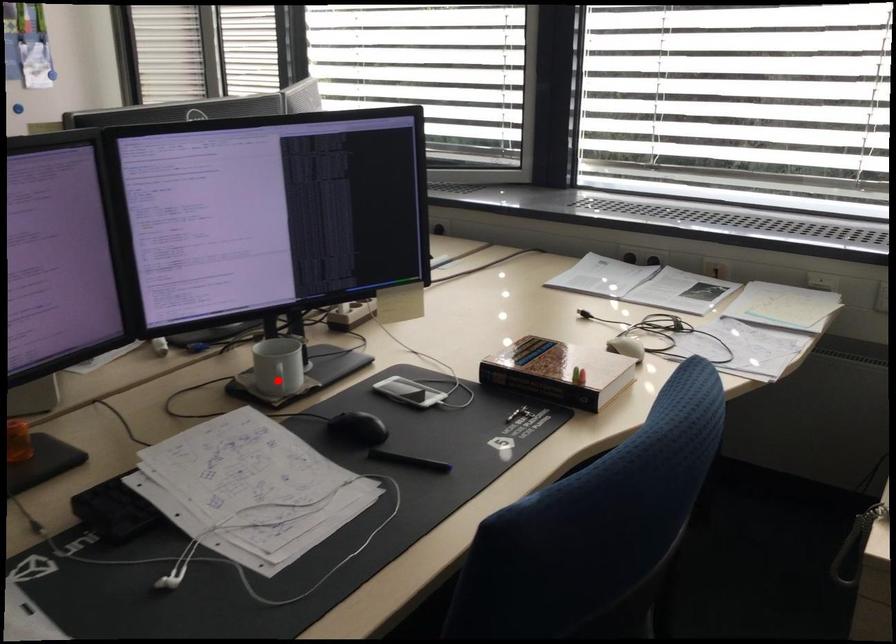
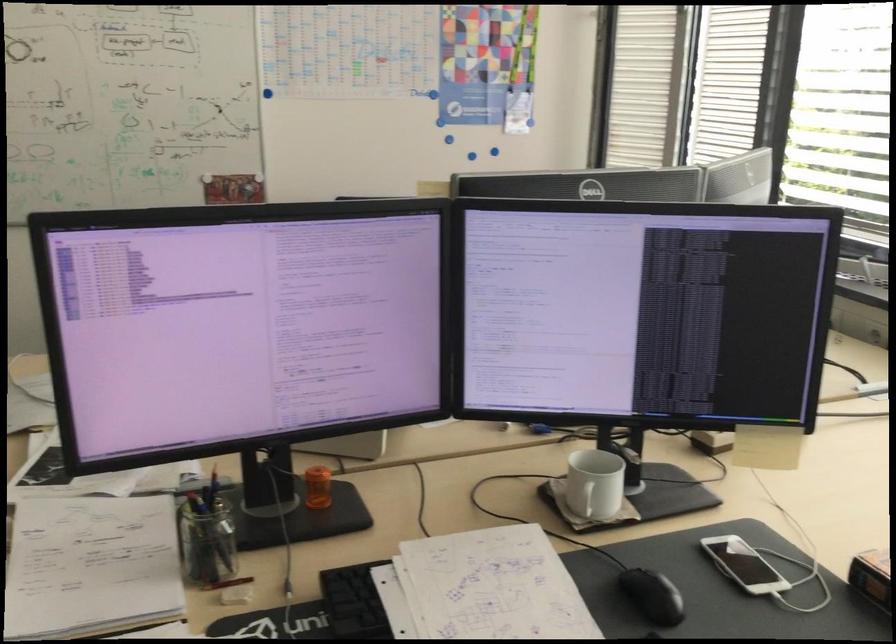
Question: I am providing you with two images of the same scene from different viewpoints. Image1 has a red point marked. In image2, the corresponding 3D location appears at what relative position? Reply with the corresponding letter.

Choices:
 (A) Closer
 (B) Farther

Answer: (A)